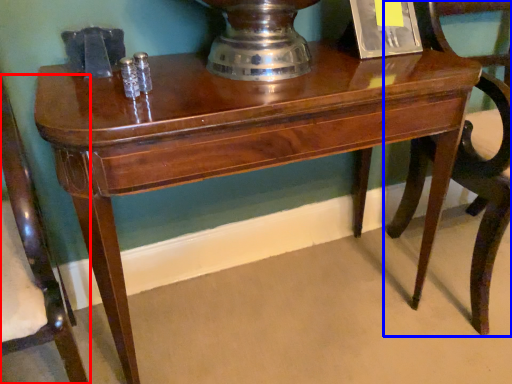
Question: Among these objects, which one is farthest to the camera, chair (highlighted by a red box) or chair (highlighted by a blue box)?

Choices:
 (A) chair
 (B) chair

Answer: (B)